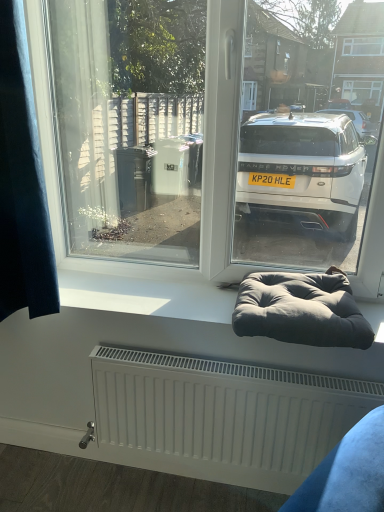
Question: In terms of width, does dark gray fabric bean bag at lower center look wider or thinner when compared to dark blue fabric at left?

Choices:
 (A) thin
 (B) wide

Answer: (B)

Question: From a real-world perspective, is dark gray fabric bean bag at lower center physically located above or below dark blue fabric at left?

Choices:
 (A) below
 (B) above

Answer: (A)

Question: Which is nearer to the dark blue fabric at left?

Choices:
 (A) white matte window sill at center
 (B) dark gray fabric bean bag at lower center

Answer: (A)

Question: Considering the real-world distances, which object is closest to the dark blue fabric at left?

Choices:
 (A) dark gray fabric bean bag at lower center
 (B) white matte window sill at center

Answer: (B)